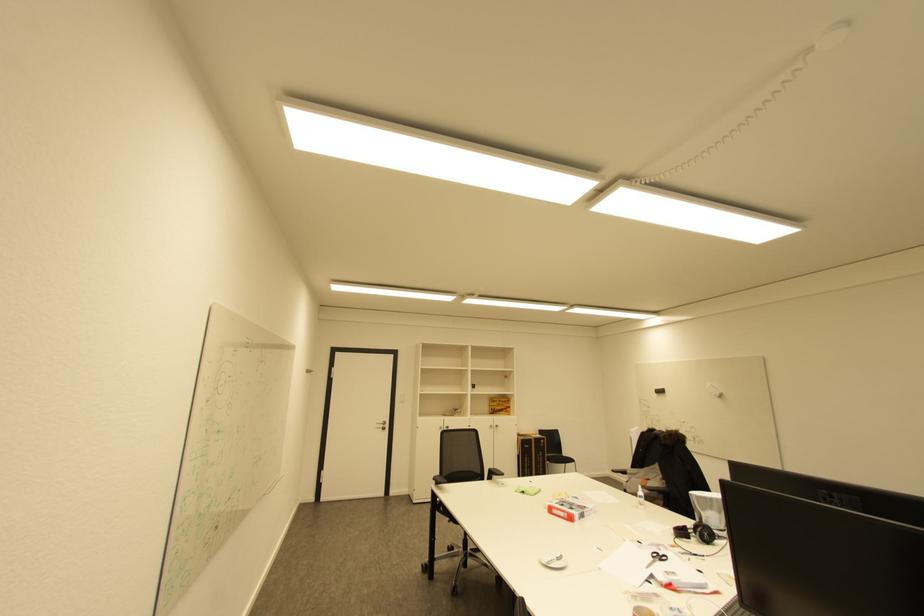
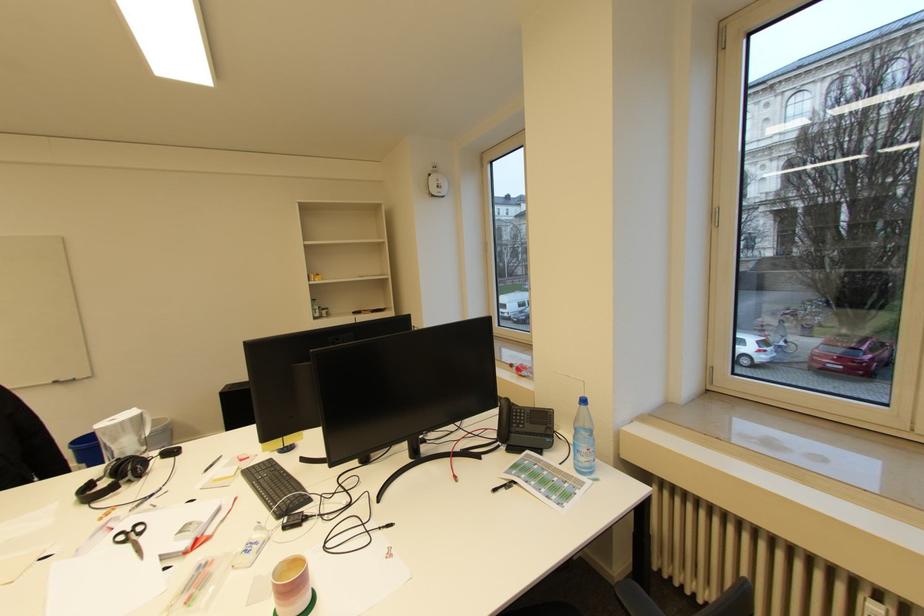
Locate, in the second image, the point that corresponds to point (670, 581) in the first image.

(192, 544)